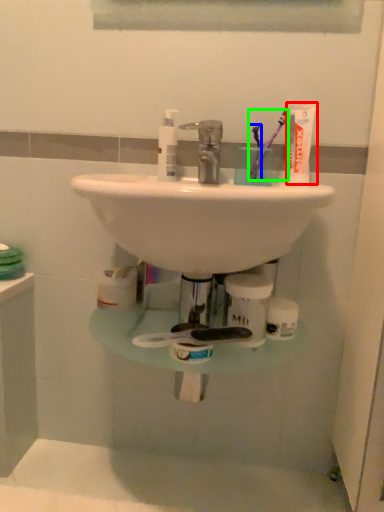
Question: Which is farther away from toothpaste (highlighted by a red box)? toothbrush (highlighted by a blue box) or toothbrush (highlighted by a green box)?

Choices:
 (A) toothbrush
 (B) toothbrush

Answer: (A)